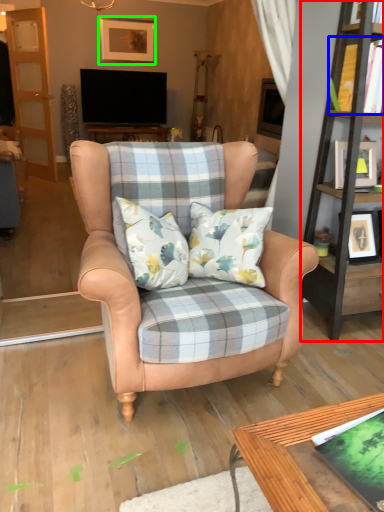
Question: Based on their relative distances, which object is farther from bookshelf (highlighted by a red box)? Choose from book (highlighted by a blue box) and picture frame (highlighted by a green box).

Choices:
 (A) book
 (B) picture frame

Answer: (B)